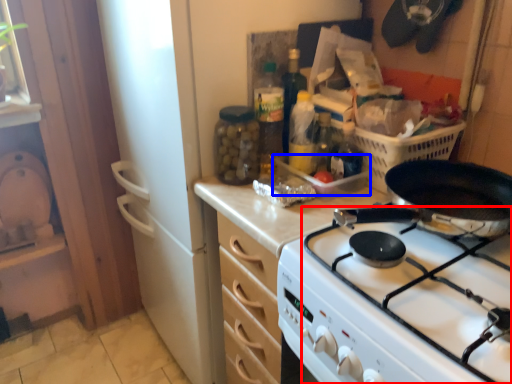
Question: Among these objects, which one is nearest to the camera, gas stove (highlighted by a red box) or appliance (highlighted by a blue box)?

Choices:
 (A) gas stove
 (B) appliance

Answer: (A)